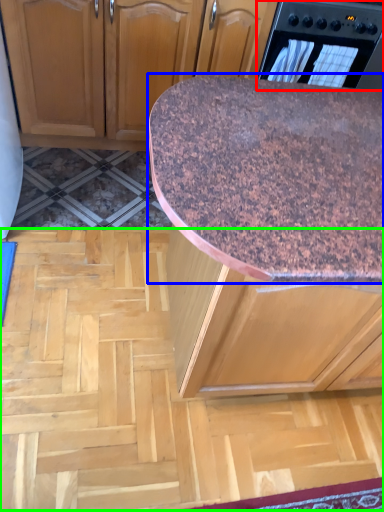
Question: Considering the real-world distances, which object is farthest from home appliance (highlighted by a red box)? countertop (highlighted by a blue box) or plywood (highlighted by a green box)?

Choices:
 (A) countertop
 (B) plywood

Answer: (B)